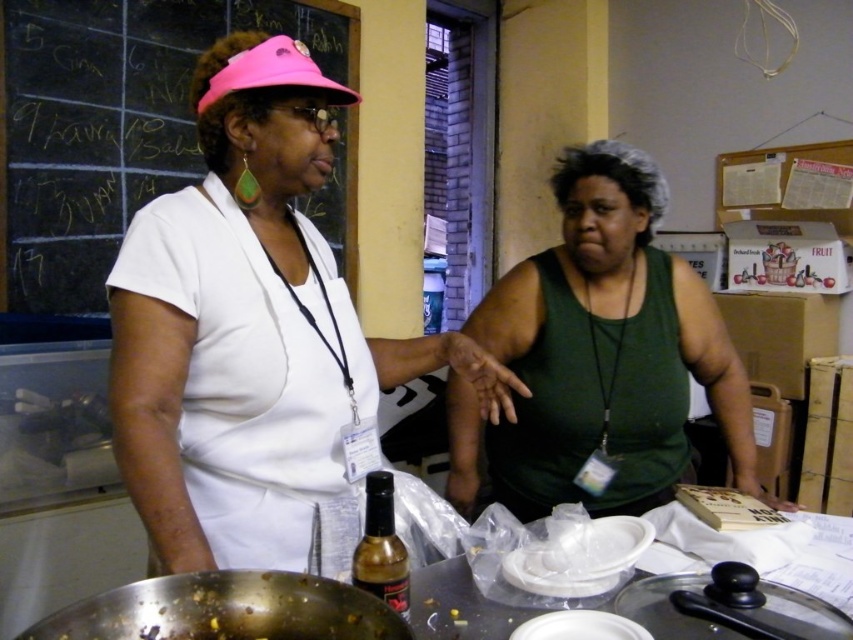
Question: Is white matte apron at center above chalkboard at upper left?

Choices:
 (A) no
 (B) yes

Answer: (A)

Question: Which object appears closest to the camera in this image?

Choices:
 (A) chalkboard at upper left
 (B) shiny brown glass bottle at center

Answer: (B)

Question: Is green matte tank top at center positioned behind chalkboard at upper left?

Choices:
 (A) yes
 (B) no

Answer: (B)

Question: Can you confirm if green matte tank top at center is positioned above translucent plastic table at center?

Choices:
 (A) no
 (B) yes

Answer: (B)

Question: Which of the following is the closest to the observer?

Choices:
 (A) translucent plastic table at center
 (B) white matte apron at center

Answer: (A)

Question: Which point is closer to the camera?

Choices:
 (A) (650, 296)
 (B) (119, 333)

Answer: (B)